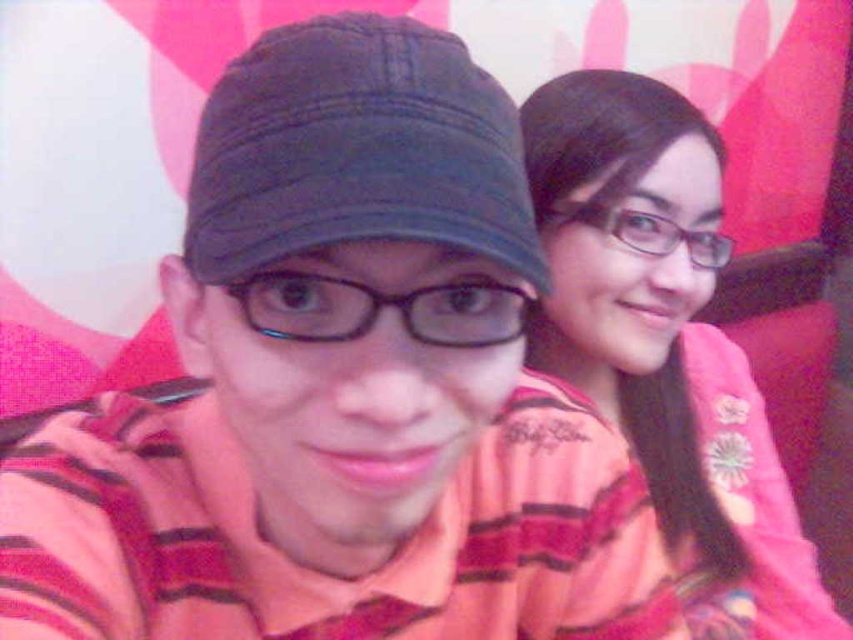
Looking at this image, is pink striped shirt at upper right above dark blue fabric cap at center?

No.

Describe the element at coordinates (665, 342) in the screenshot. I see `pink striped shirt at upper right` at that location.

Locate an element on the screen. pink striped shirt at upper right is located at coordinates click(x=665, y=342).